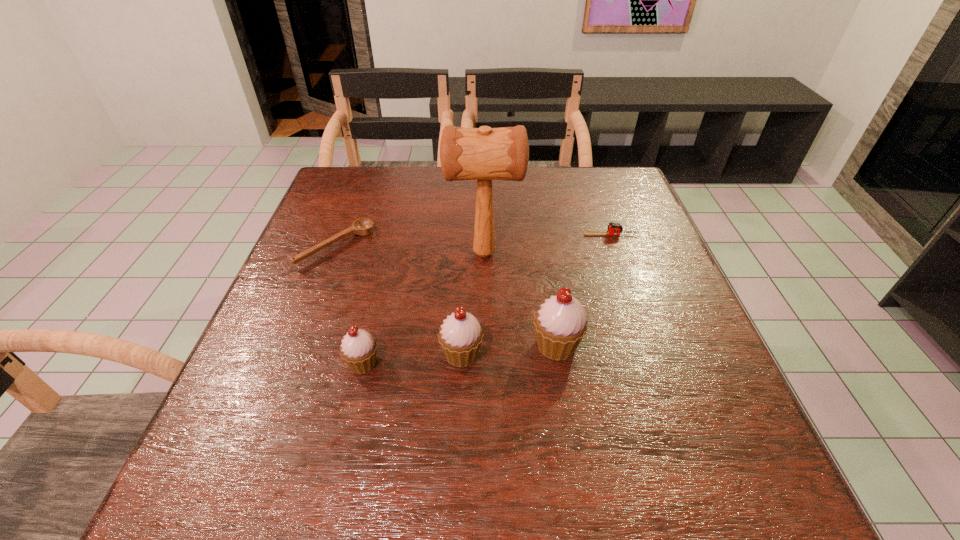
Considering the uniform spacing of cupcakes, where should an additional cupcake be positioned on the right? Please locate a free spot. Please provide its 2D coordinates. Your answer should be formatted as a tuple, i.e. [(x, y)], where the tuple contains the x and y coordinates of a point satisfying the conditions above.

[(648, 337)]